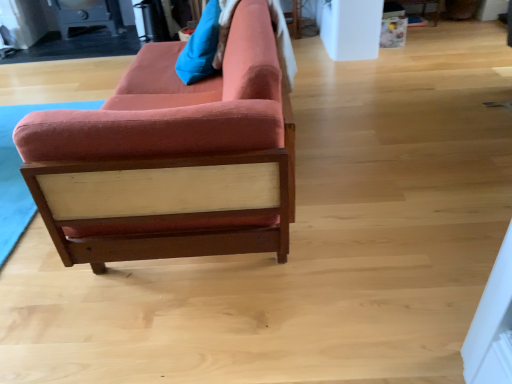
Question: Choose the correct answer: Is blue fabric pillow at upper center inside velvet red couch at left or outside it?

Choices:
 (A) outside
 (B) inside

Answer: (B)

Question: From the image's perspective, is blue fabric pillow at upper center positioned above or below velvet red couch at left?

Choices:
 (A) above
 (B) below

Answer: (A)

Question: Considering their positions, is blue fabric pillow at upper center located in front of or behind velvet red couch at left?

Choices:
 (A) behind
 (B) front

Answer: (A)

Question: Is velvet red couch at left inside the boundaries of blue fabric pillow at upper center, or outside?

Choices:
 (A) inside
 (B) outside

Answer: (B)

Question: Based on their sizes in the image, would you say velvet red couch at left is bigger or smaller than blue fabric pillow at upper center?

Choices:
 (A) big
 (B) small

Answer: (A)

Question: From the image's perspective, is velvet red couch at left located above or below blue fabric pillow at upper center?

Choices:
 (A) below
 (B) above

Answer: (A)

Question: From a real-world perspective, is velvet red couch at left physically located above or below blue fabric pillow at upper center?

Choices:
 (A) above
 (B) below

Answer: (B)